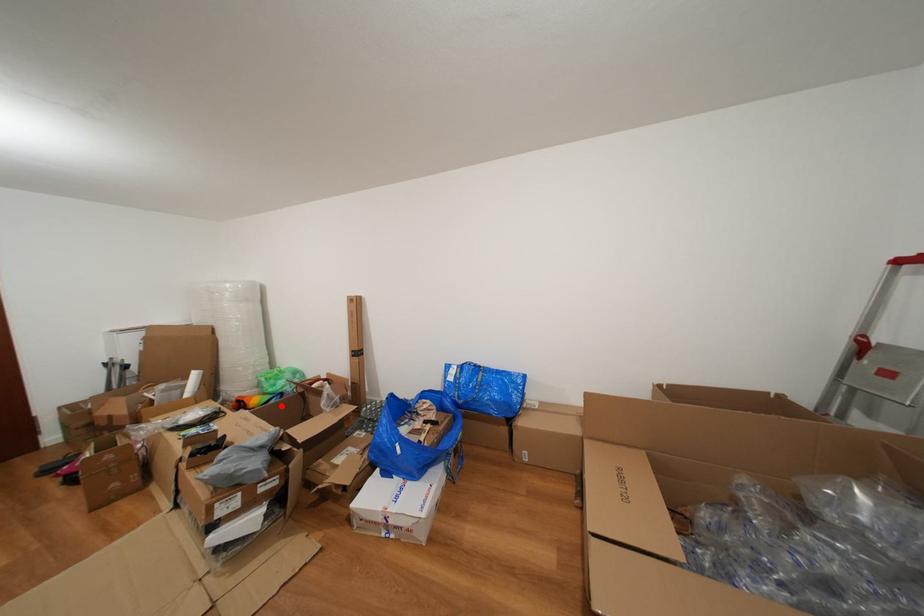
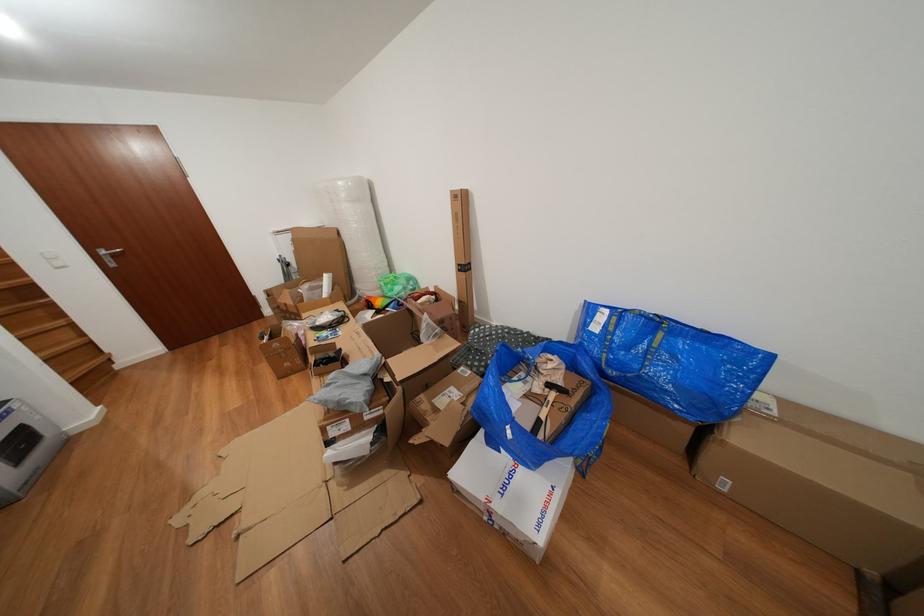
In the second image, find the point that corresponds to the highlighted location in the first image.

(399, 310)